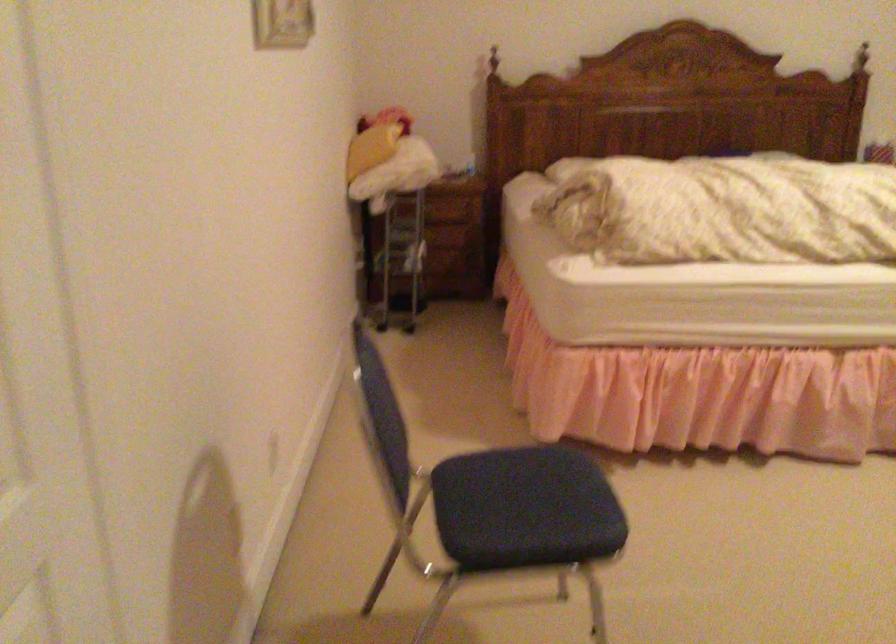
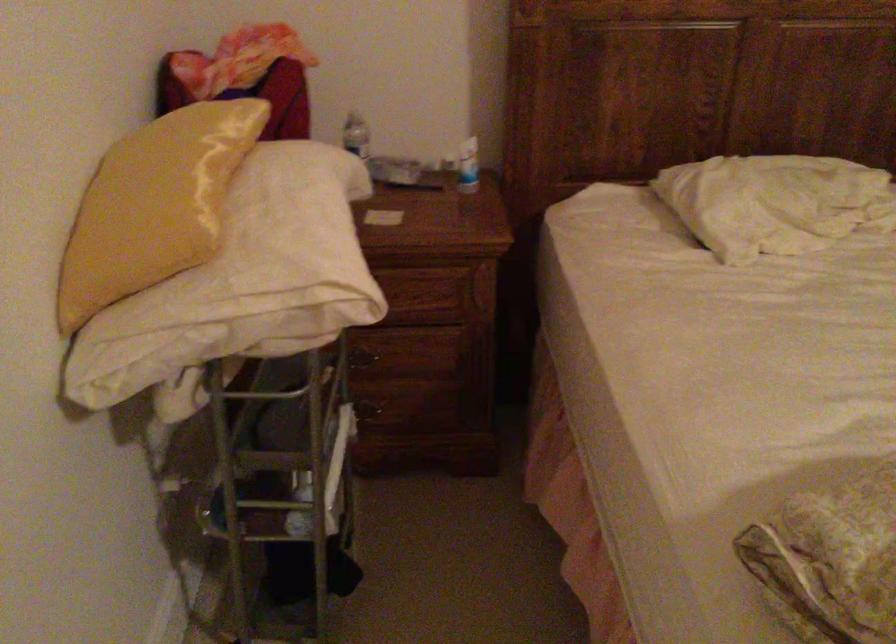
The point at [400,154] is marked in the first image. Where is the corresponding point in the second image?

(254, 272)